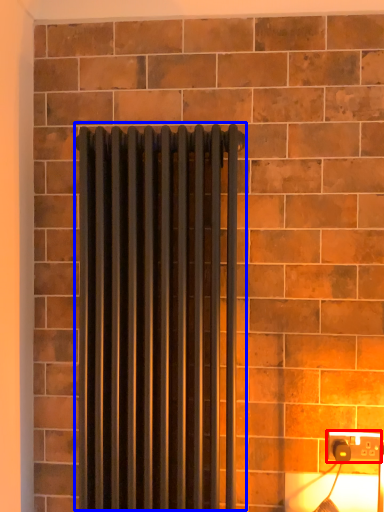
Question: Which object appears farthest to the camera in this image, power plugs and sockets (highlighted by a red box) or radiator (highlighted by a blue box)?

Choices:
 (A) power plugs and sockets
 (B) radiator

Answer: (A)